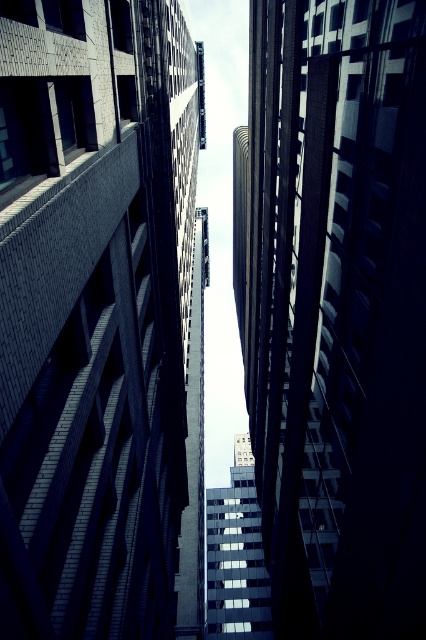
Is point (63, 552) positioned before point (244, 172)?

That is True.

Is point (108, 58) farther from camera compared to point (386, 612)?

Yes.

Who is more forward, (106,285) or (275,444)?

Point (106,285) is in front.

Image resolution: width=426 pixels, height=640 pixels. I want to click on brick wall at center, so click(x=94, y=310).